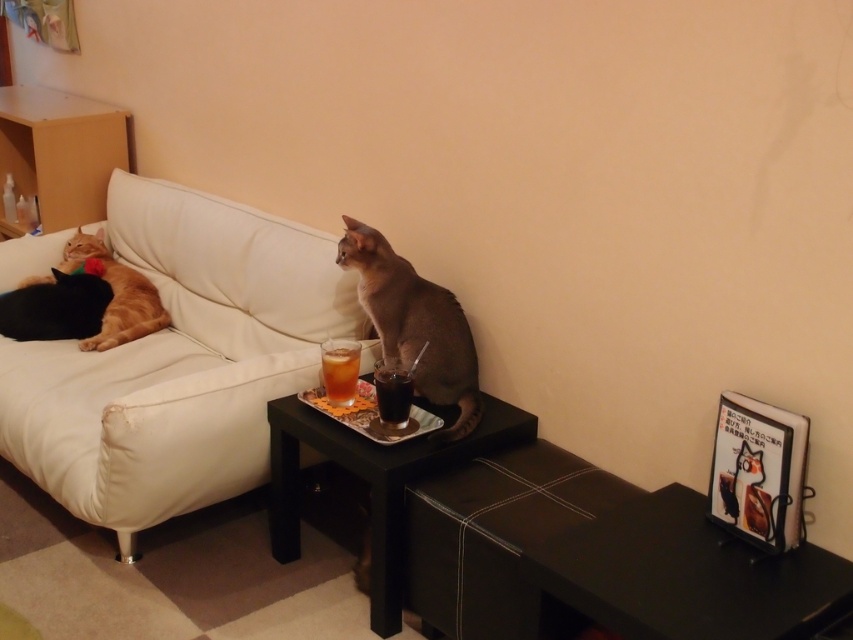
Question: Among these objects, which one is nearest to the camera?

Choices:
 (A) white leather couch at upper left
 (B) silvery gray fur at center

Answer: (A)

Question: Where is silvery gray fur at center located in relation to metallic silver tray at lower center in the image?

Choices:
 (A) above
 (B) below

Answer: (A)

Question: Is metallic silver tray at lower center positioned behind translucent glass drink at center?

Choices:
 (A) yes
 (B) no

Answer: (B)

Question: Among these objects, which one is nearest to the camera?

Choices:
 (A) black matte side table at lower center
 (B) dark glass cup at center
 (C) white leather couch at upper left
 (D) silvery gray fur at center

Answer: (A)

Question: Is white leather couch at upper left below metallic silver tray at lower center?

Choices:
 (A) no
 (B) yes

Answer: (A)

Question: Which point is closer to the camera taking this photo?

Choices:
 (A) (399, 369)
 (B) (125, 336)
 (C) (408, 262)

Answer: (A)